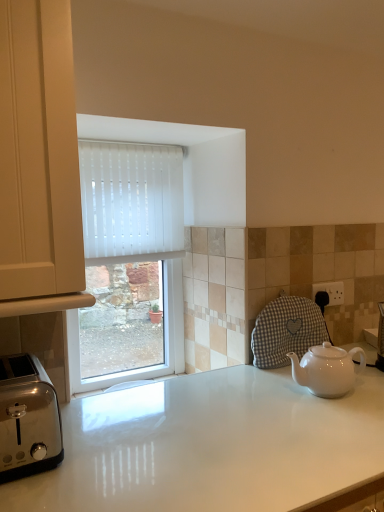
The height and width of the screenshot is (512, 384). In order to click on vacant space that is in between polished stainless steel toaster at lower left and white ceramic teapot at lower right in this screenshot , I will do (177, 417).